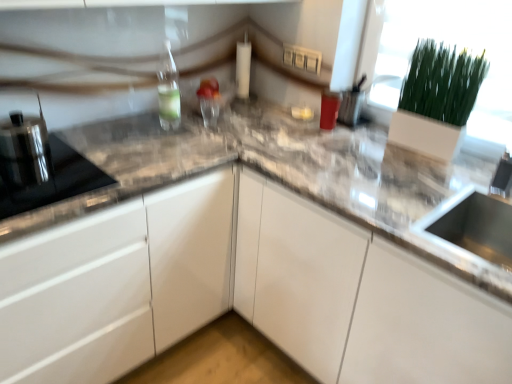
Locate an element on the screen. free space in front of clear glass bottle at upper left is located at coordinates (161, 144).